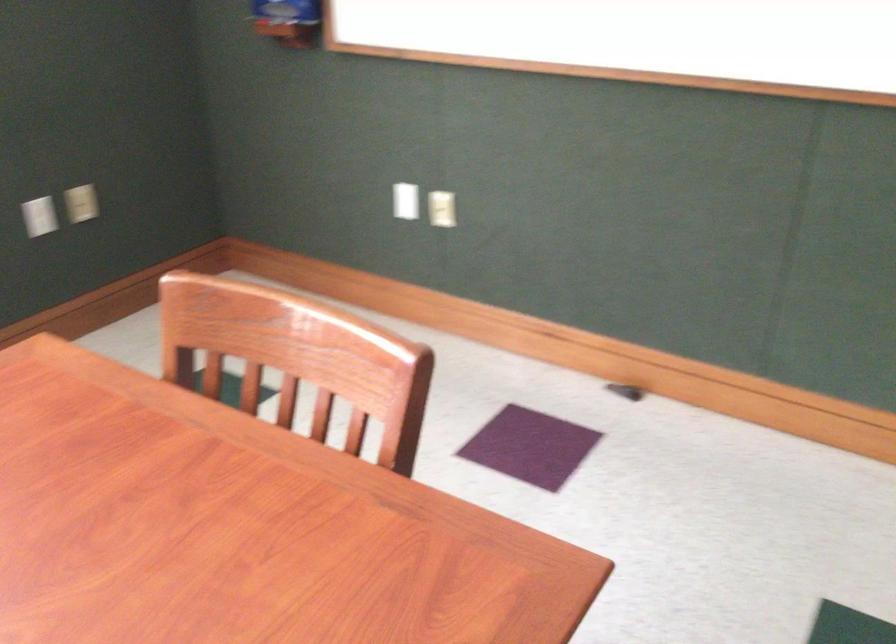
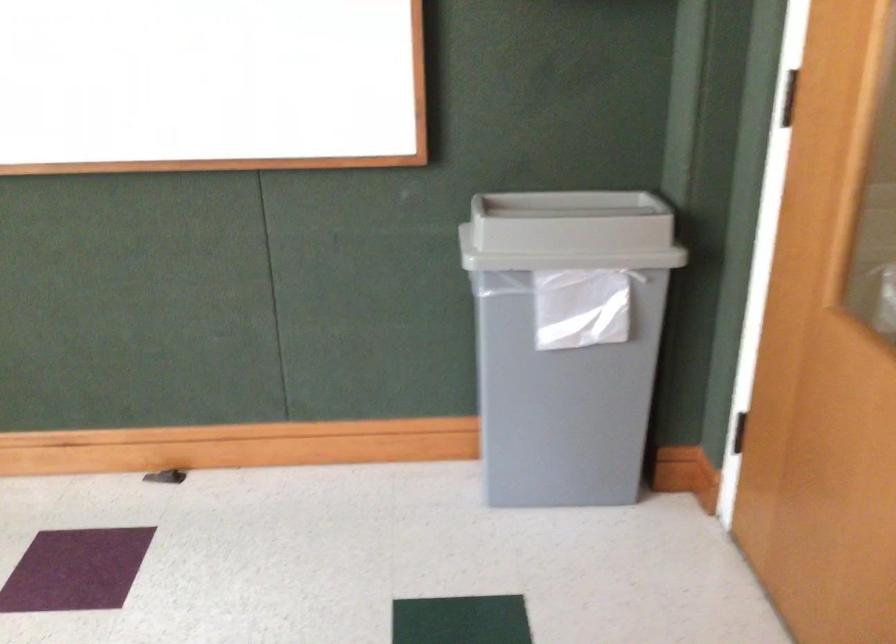
Question: The camera is either moving clockwise (left) or counter-clockwise (right) around the object. The first image is from the beginning of the video and the second image is from the end. Is the camera moving left or right when shooting the video?

Choices:
 (A) Left
 (B) Right

Answer: (A)